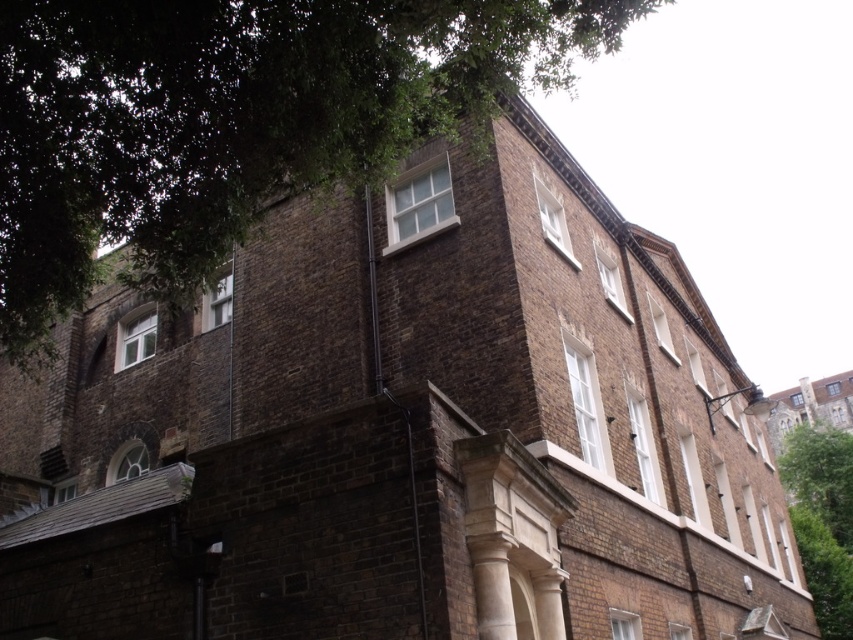
Does green leafy tree at upper left have a lesser height compared to green leafy tree at lower right?

No.

Is green leafy tree at upper left positioned behind green leafy tree at lower right?

No, green leafy tree at upper left is in front of green leafy tree at lower right.

Does point (596, 4) lie in front of point (809, 513)?

Yes.

Locate an element on the screen. green leafy tree at upper left is located at coordinates (233, 122).

Describe the element at coordinates (820, 476) in the screenshot. The image size is (853, 640). I see `green leafy tree at right` at that location.

Is point (798, 454) positioned in front of point (842, 621)?

That is False.

Is point (815, 493) behind point (824, 532)?

Yes, it is behind point (824, 532).

You are a GUI agent. You are given a task and a screenshot of the screen. Output one action in this format:
    pyautogui.click(x=<x>, y=<y>)
    Task: Click on the green leafy tree at right
    The image size is (853, 640).
    Given the screenshot: What is the action you would take?
    pyautogui.click(x=820, y=476)

Is point (151, 131) more distant than point (828, 496)?

No, it is in front of (828, 496).

Is point (395, 54) positioned before point (850, 465)?

Yes, it is.

Identify the location of green leafy tree at upper left. (233, 122).